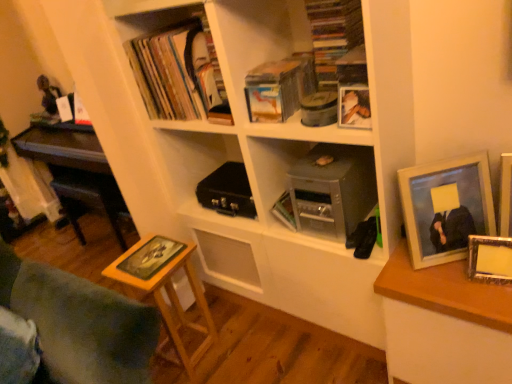
Identify the location of free space above wooden table at lower left (from a real-world perspective). (142, 258).